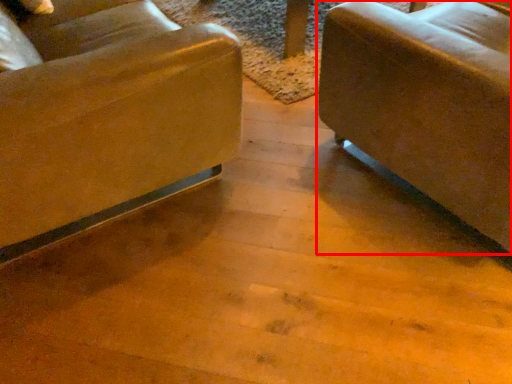
Question: From the image's perspective, considering the relative positions of studio couch (annotated by the red box) and chair in the image provided, where is studio couch (annotated by the red box) located with respect to the staircase?

Choices:
 (A) above
 (B) below

Answer: (B)